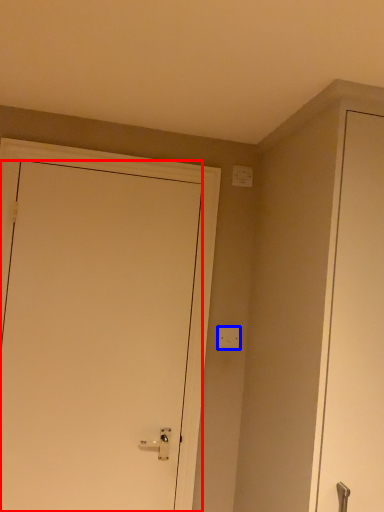
Question: Among these objects, which one is farthest to the camera, door (highlighted by a red box) or light switch (highlighted by a blue box)?

Choices:
 (A) door
 (B) light switch

Answer: (B)